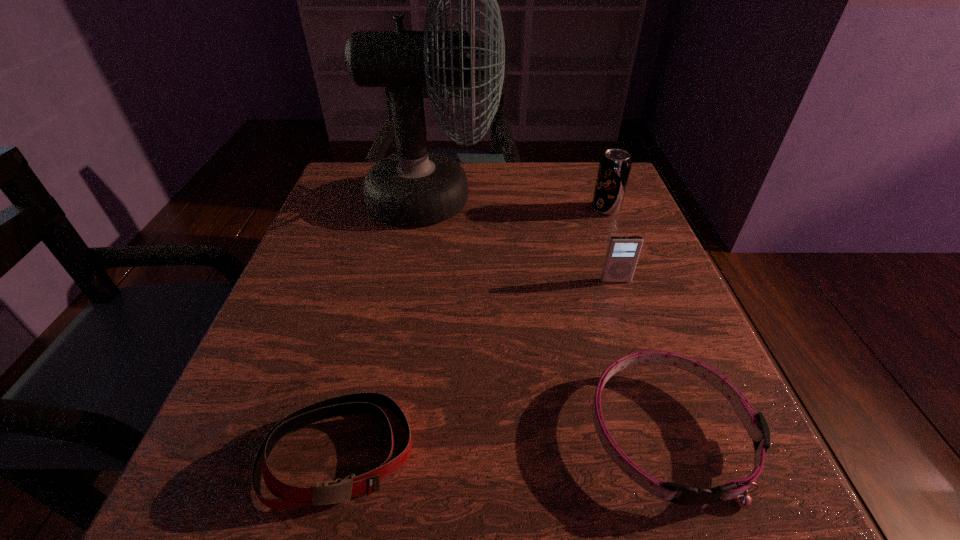
I want to click on vacant area between the left dog collar and the right dog collar, so pyautogui.click(x=505, y=443).

Locate an element on the screen. unoccupied area between the tallest object and the left dog collar is located at coordinates (387, 327).

At what (x,y) coordinates should I click in order to perform the action: click on vacant area that lies between the third farthest object and the left dog collar. Please return your answer as a coordinate pair (x, y). The image size is (960, 540). Looking at the image, I should click on (478, 367).

Locate an element on the screen. vacant area that lies between the fourth shortest object and the fan is located at coordinates (519, 205).

In order to click on unoccupied area between the third farthest object and the left dog collar in this screenshot , I will do `click(478, 367)`.

Where is `the second closest object to the left dog collar`? The height and width of the screenshot is (540, 960). the second closest object to the left dog collar is located at coordinates (414, 187).

Image resolution: width=960 pixels, height=540 pixels. What are the coordinates of `the closest object to the second tallest object` in the screenshot? It's located at (622, 253).

Identify the location of vacant position in the image that satisfies the following two spatial constraints: 1. in front of the soda can where the airflow is directed; 2. on the left side of the tallest object. (432, 210).

Locate an element on the screen. free spot that satisfies the following two spatial constraints: 1. in front of the tallest object where the airflow is directed; 2. on the left side of the soda can is located at coordinates (432, 210).

Where is `vacant position in the image that satisfies the following two spatial constraints: 1. in front of the soda can where the airflow is directed; 2. on the right side of the tallest object`? This screenshot has height=540, width=960. vacant position in the image that satisfies the following two spatial constraints: 1. in front of the soda can where the airflow is directed; 2. on the right side of the tallest object is located at coordinates (432, 210).